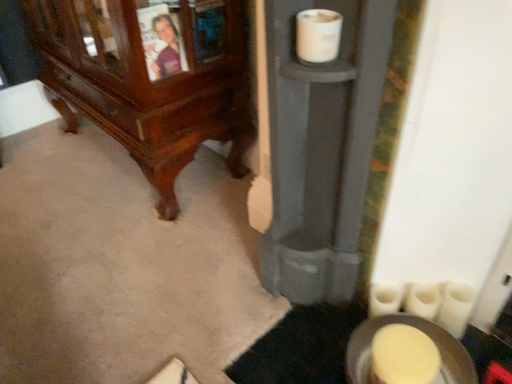
Question: Considering the relative sizes of white matte toilet paper at lower right, the second toilet paper viewed from the back, and white matte toilet paper at lower right, the second toilet paper from the right, in the image provided, is white matte toilet paper at lower right, the second toilet paper viewed from the back, taller than white matte toilet paper at lower right, the second toilet paper from the right,?

Choices:
 (A) yes
 (B) no

Answer: (A)

Question: From the image's perspective, is white matte toilet paper at lower right, the second toilet paper viewed from the back, under white matte toilet paper at lower right, the 2th toilet paper in the left-to-right sequence?

Choices:
 (A) no
 (B) yes

Answer: (B)

Question: Is white matte toilet paper at lower right, the first toilet paper positioned from the bottom, not close to white matte toilet paper at lower right, acting as the 3th toilet paper starting from the front?

Choices:
 (A) yes
 (B) no

Answer: (B)

Question: Does white matte toilet paper at lower right, the second toilet paper when ordered from front to back, appear on the left side of white matte toilet paper at lower right, which is counted as the 2th toilet paper, starting from the top?

Choices:
 (A) yes
 (B) no

Answer: (B)

Question: Is white matte toilet paper at lower right, the 2th toilet paper positioned from the bottom, completely or partially inside white matte toilet paper at lower right, which appears as the 1th toilet paper when viewed from the right?

Choices:
 (A) yes
 (B) no

Answer: (B)

Question: Is polished wood cabinet at lower left to the left or to the right of white matte toilet paper at upper center, which is the third toilet paper in right-to-left order, in the image?

Choices:
 (A) right
 (B) left

Answer: (B)

Question: Is polished wood cabinet at lower left in front of or behind white matte toilet paper at upper center, which ranks as the 1th toilet paper in top-to-bottom order, in the image?

Choices:
 (A) front
 (B) behind

Answer: (B)

Question: From their relative heights in the image, would you say polished wood cabinet at lower left is taller or shorter than white matte toilet paper at upper center, which ranks as the 1th toilet paper in top-to-bottom order?

Choices:
 (A) tall
 (B) short

Answer: (A)

Question: Is point (163, 86) closer or farther from the camera than point (337, 33)?

Choices:
 (A) farther
 (B) closer

Answer: (A)

Question: Based on their sizes in the image, would you say polished wood cabinet at lower left is bigger or smaller than white matte toilet paper at lower right, the 2th toilet paper positioned from the bottom?

Choices:
 (A) small
 (B) big

Answer: (B)

Question: From a real-world perspective, is polished wood cabinet at lower left positioned above or below white matte toilet paper at lower right, acting as the 3th toilet paper starting from the front?

Choices:
 (A) below
 (B) above

Answer: (B)

Question: From the image's perspective, is polished wood cabinet at lower left located above or below white matte toilet paper at lower right, acting as the 3th toilet paper starting from the front?

Choices:
 (A) above
 (B) below

Answer: (A)

Question: In the image, is polished wood cabinet at lower left positioned in front of or behind white matte toilet paper at lower right, which is counted as the 2th toilet paper, starting from the top?

Choices:
 (A) behind
 (B) front

Answer: (B)

Question: Is point (396, 291) positioned closer to the camera than point (308, 38)?

Choices:
 (A) closer
 (B) farther

Answer: (B)

Question: Considering their positions, is white matte toilet paper at lower right, the 2th toilet paper positioned from the bottom, located in front of or behind white matte toilet paper at upper center, which ranks as the 1th toilet paper in top-to-bottom order?

Choices:
 (A) behind
 (B) front

Answer: (A)